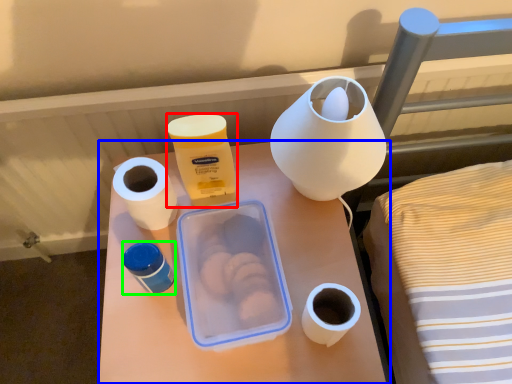
Question: Which object is the closest to the product (highlighted by a red box)? Choose among these: table (highlighted by a blue box) or pottery (highlighted by a green box).

Choices:
 (A) table
 (B) pottery

Answer: (B)